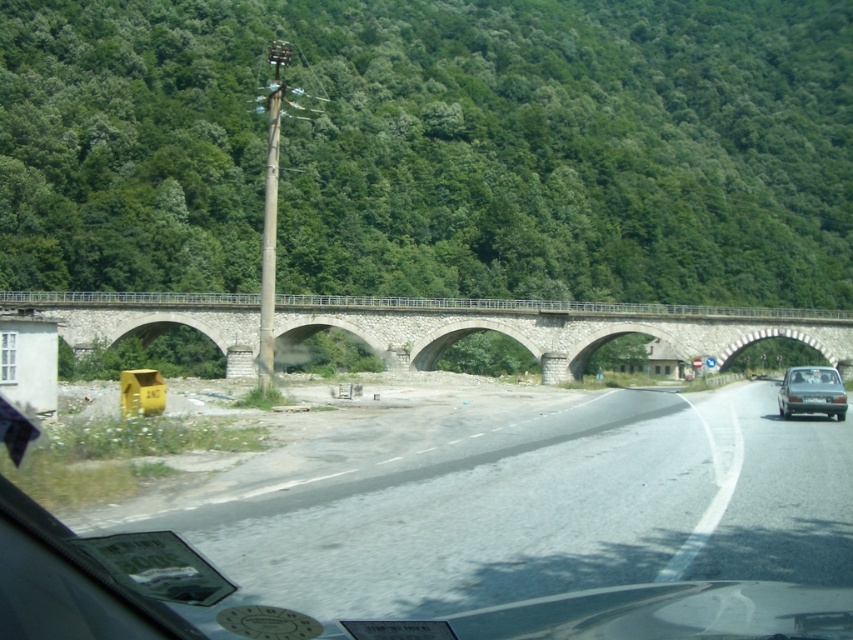
You are driving a car with a 5 meter braking distance. You see the asphalt road at center ahead. Can you stop before reaching it?

The asphalt road at center is 4.99 meters away from the camera. Since your braking distance is 5 meters, you can stop before reaching it.